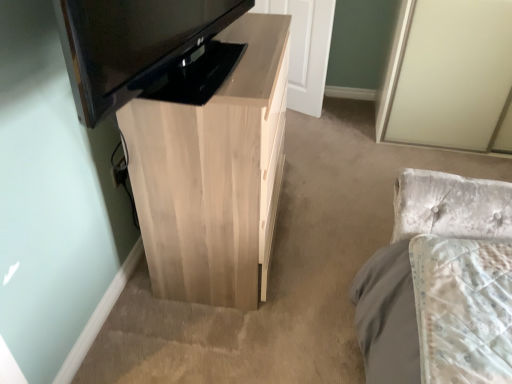
Question: Is black glossy television at upper left facing away from white wood door at center?

Choices:
 (A) no
 (B) yes

Answer: (A)

Question: Considering the relative sizes of black glossy television at upper left and white wood door at center in the image provided, is black glossy television at upper left thinner than white wood door at center?

Choices:
 (A) yes
 (B) no

Answer: (B)

Question: Does black glossy television at upper left have a larger size compared to white wood door at center?

Choices:
 (A) no
 (B) yes

Answer: (B)

Question: Is black glossy television at upper left aimed at white wood door at center?

Choices:
 (A) yes
 (B) no

Answer: (B)

Question: Is black glossy television at upper left shorter than white wood door at center?

Choices:
 (A) no
 (B) yes

Answer: (B)

Question: Relative to black glossy television at upper left, is light wood cabinet at center in front or behind?

Choices:
 (A) front
 (B) behind

Answer: (B)

Question: Considering the relative positions of light wood cabinet at center and black glossy television at upper left in the image provided, is light wood cabinet at center to the left or to the right of black glossy television at upper left?

Choices:
 (A) right
 (B) left

Answer: (A)

Question: Considering the positions of light wood cabinet at center and black glossy television at upper left in the image, is light wood cabinet at center taller or shorter than black glossy television at upper left?

Choices:
 (A) tall
 (B) short

Answer: (A)

Question: Considering the positions of point (166, 140) and point (156, 49), is point (166, 140) closer or farther from the camera than point (156, 49)?

Choices:
 (A) farther
 (B) closer

Answer: (A)

Question: In terms of width, does light wood cabinet at center look wider or thinner when compared to white wood door at center?

Choices:
 (A) thin
 (B) wide

Answer: (B)

Question: From a real-world perspective, is light wood cabinet at center physically located above or below white wood door at center?

Choices:
 (A) below
 (B) above

Answer: (B)

Question: In terms of height, does light wood cabinet at center look taller or shorter compared to white wood door at center?

Choices:
 (A) short
 (B) tall

Answer: (B)

Question: Considering their positions, is light wood cabinet at center located in front of or behind white wood door at center?

Choices:
 (A) behind
 (B) front

Answer: (B)

Question: In terms of size, does white wood door at center appear bigger or smaller than black glossy television at upper left?

Choices:
 (A) big
 (B) small

Answer: (B)

Question: Considering the positions of white wood door at center and black glossy television at upper left in the image, is white wood door at center wider or thinner than black glossy television at upper left?

Choices:
 (A) wide
 (B) thin

Answer: (B)